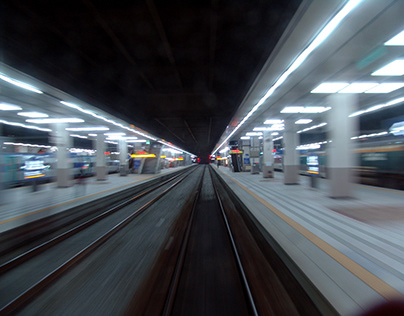
Where is `long strip ceiling light on right platform`? Image resolution: width=404 pixels, height=316 pixels. long strip ceiling light on right platform is located at coordinates (333, 27).